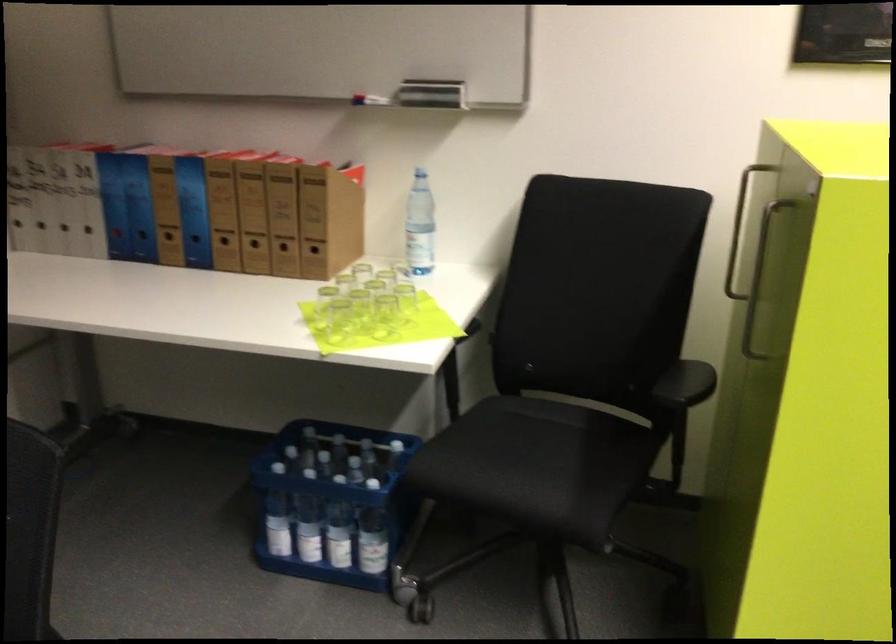
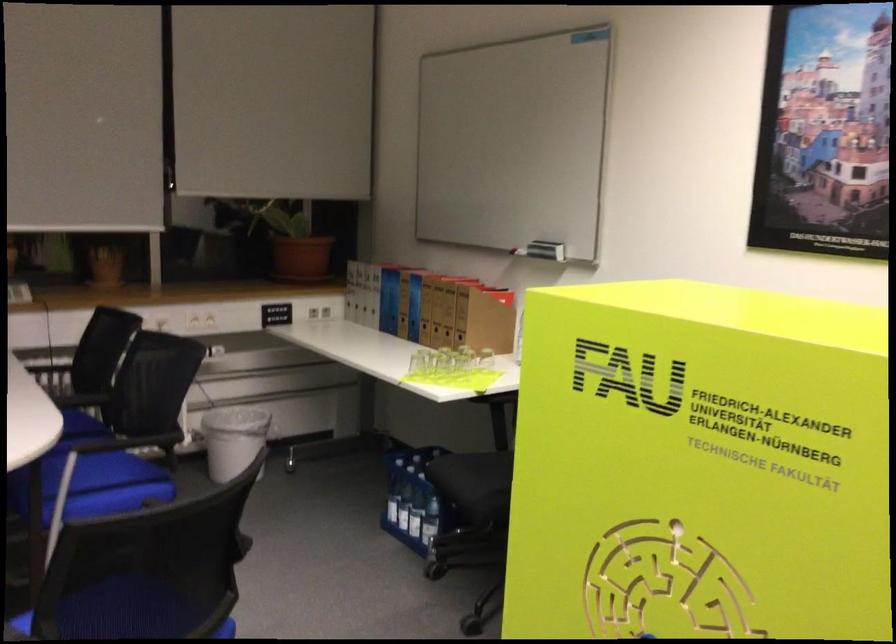
Question: I am providing you with two images of the same scene from different viewpoints. Which of the following objects are not visible in image2?

Choices:
 (A) metal cabinet handle
 (B) white trash can
 (C) white window frame
 (D) plastic water bottle

Answer: (A)